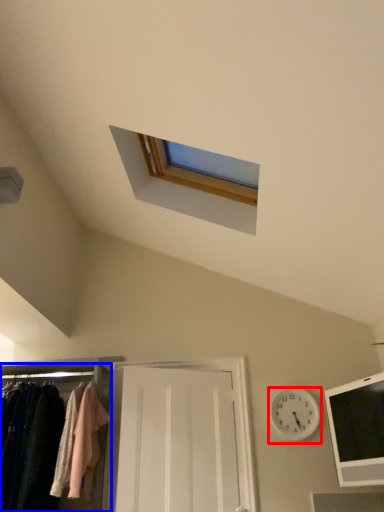
Question: Among these objects, which one is farthest to the camera, clock (highlighted by a red box) or closet (highlighted by a blue box)?

Choices:
 (A) clock
 (B) closet

Answer: (A)